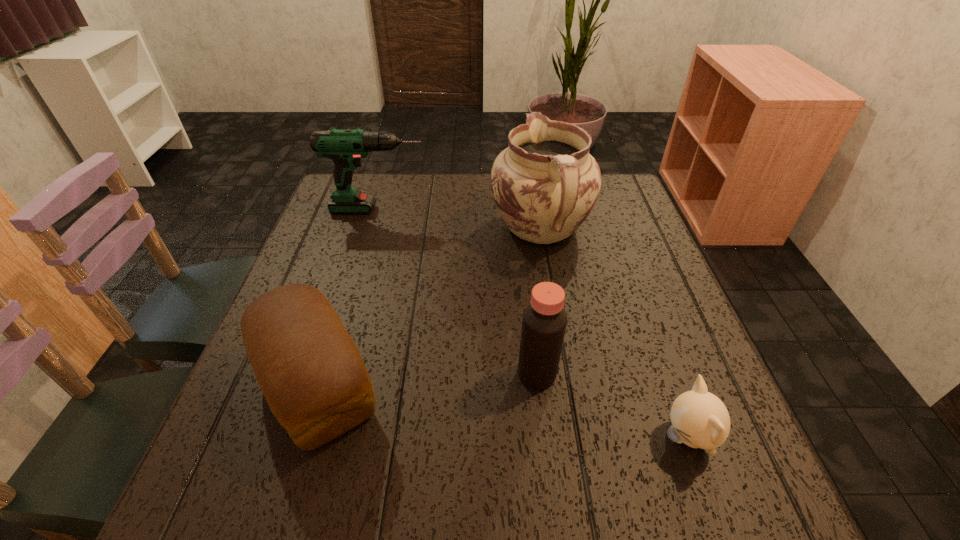
Where is `free spot between the kitten and the pitcher`? The width and height of the screenshot is (960, 540). free spot between the kitten and the pitcher is located at coordinates (614, 333).

This screenshot has height=540, width=960. Identify the location of vacant point located between the vinegar and the bread. (427, 379).

At what (x,y) coordinates should I click in order to perform the action: click on vacant area between the bread and the vinegar. Please return your answer as a coordinate pair (x, y). Image resolution: width=960 pixels, height=540 pixels. Looking at the image, I should click on (427, 379).

Identify the location of vacant space in between the second shortest object and the drill. The height and width of the screenshot is (540, 960). (348, 297).

Where is `free point between the shortest object and the vinegar`? The height and width of the screenshot is (540, 960). free point between the shortest object and the vinegar is located at coordinates tap(612, 406).

Find the location of a particular element. The height and width of the screenshot is (540, 960). vacant space that is in between the pitcher and the rightmost object is located at coordinates (614, 333).

The image size is (960, 540). In order to click on vacant area that lies between the drill and the second shortest object in this screenshot , I will do `click(348, 297)`.

Image resolution: width=960 pixels, height=540 pixels. Identify the location of unoccupied position between the vinegar and the drill. (458, 292).

The height and width of the screenshot is (540, 960). Identify the location of object that is the closest to the rightmost object. (544, 321).

Identify which object is the second closest to the pitcher. Please provide its 2D coordinates. Your answer should be formatted as a tuple, i.e. [(x, y)], where the tuple contains the x and y coordinates of a point satisfying the conditions above.

[(544, 321)]